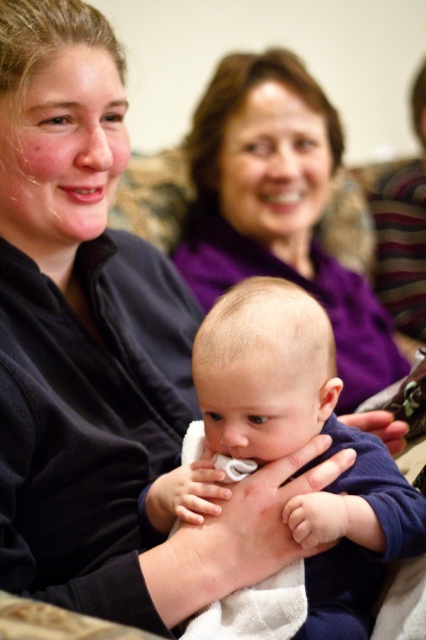
You are a photographer standing in front of the scene described. You want to take a closeup photo of the smooth blue shirt at center without including any other objects in the frame. Based on the distance provided, what is the minimum focal length lens you should use if your camera has a sensor size of 36mm x 24mm and you want to avoid distortion?

The smooth blue shirt at center is 28.14 inches away from the viewer. To avoid distortion and capture a closeup without including other objects, a lens with a focal length of at least 100mm is recommended for a full frame sensor size of 36mm x 24mm.

You are a photographer adjusting your camera settings. You notice the smooth blue shirt at center and the purple fabric at upper center. Which object should you focus on to ensure it appears sharp in the photo?

The smooth blue shirt at center is closer to the viewer than the purple fabric at upper center, so focusing on the smooth blue shirt at center will ensure it appears sharp.